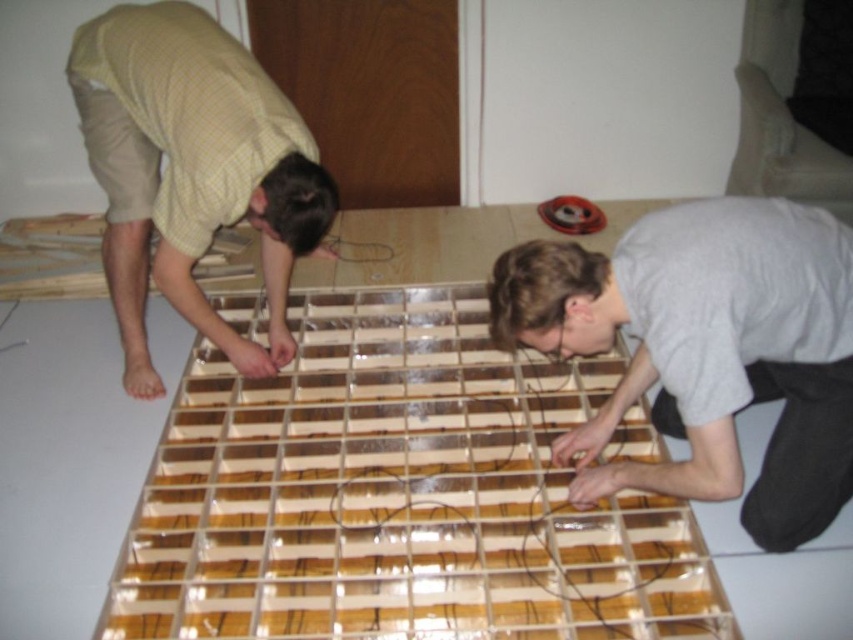
Question: Is gray matte shirt at lower right to the right of matte yellow shirt at left from the viewer's perspective?

Choices:
 (A) no
 (B) yes

Answer: (B)

Question: Does gray matte shirt at lower right have a smaller size compared to matte yellow shirt at left?

Choices:
 (A) yes
 (B) no

Answer: (A)

Question: Which of the following is the farthest from the observer?

Choices:
 (A) matte yellow shirt at left
 (B) gray matte shirt at lower right

Answer: (A)

Question: Is gray matte shirt at lower right to the right of matte yellow shirt at left from the viewer's perspective?

Choices:
 (A) no
 (B) yes

Answer: (B)